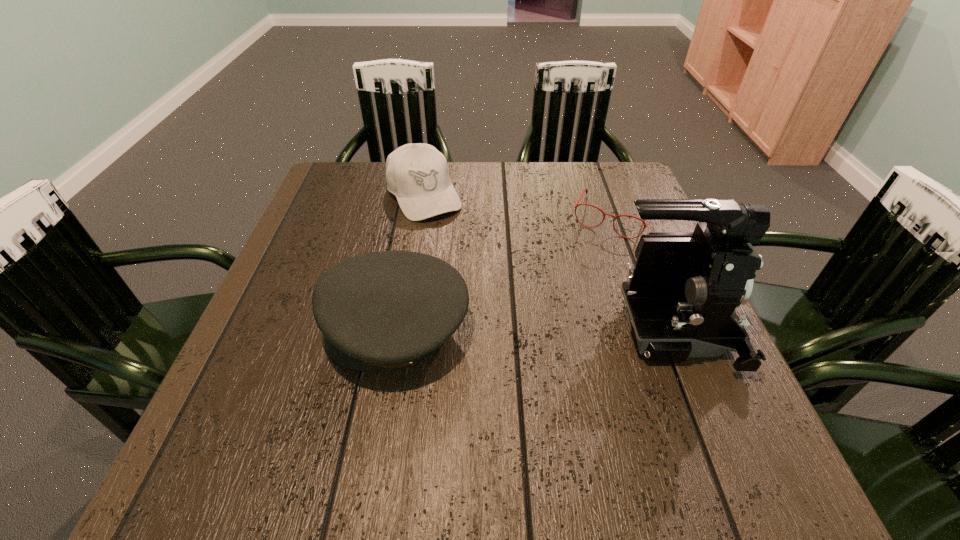
Identify the location of free point at the far edge. (505, 190).

Identify the location of free location at the near edge of the desktop. Image resolution: width=960 pixels, height=540 pixels. (628, 386).

Locate an element on the screen. free space at the left edge of the desktop is located at coordinates (305, 215).

Where is `vacant area at the right edge of the desktop`? vacant area at the right edge of the desktop is located at coordinates (678, 372).

Locate an element on the screen. Image resolution: width=960 pixels, height=540 pixels. free location at the far left corner of the desktop is located at coordinates tap(360, 165).

Locate an element on the screen. This screenshot has height=540, width=960. vacant space at the far right corner of the desktop is located at coordinates (611, 194).

The width and height of the screenshot is (960, 540). Identify the location of free space between the beret and the spectacles. (504, 273).

Identify the location of free point between the baseball cap and the camcorder. This screenshot has width=960, height=540. (545, 264).

The height and width of the screenshot is (540, 960). Identify the location of free point between the shortest object and the beret. (504, 273).

Locate an element on the screen. This screenshot has height=540, width=960. vacant area that lies between the camcorder and the baseball cap is located at coordinates (545, 264).